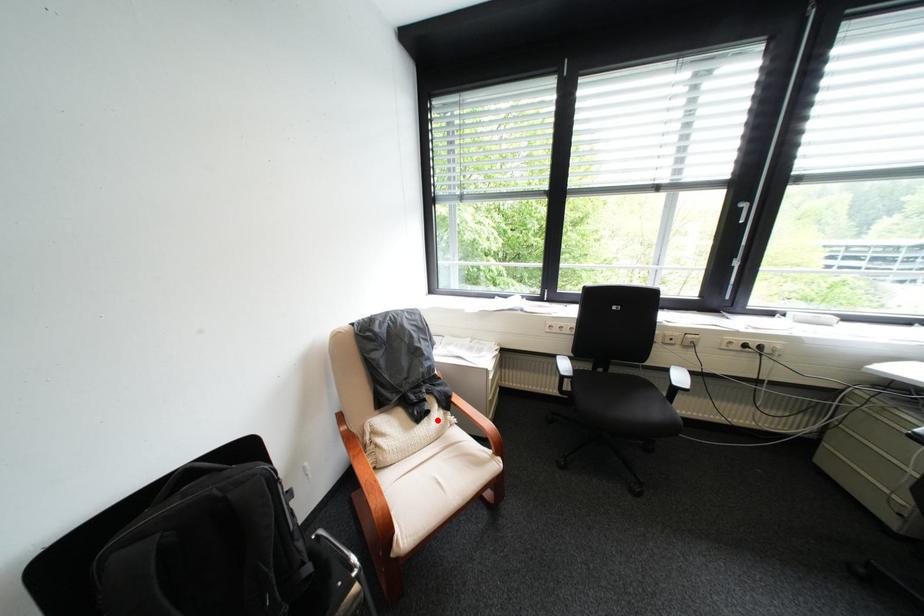
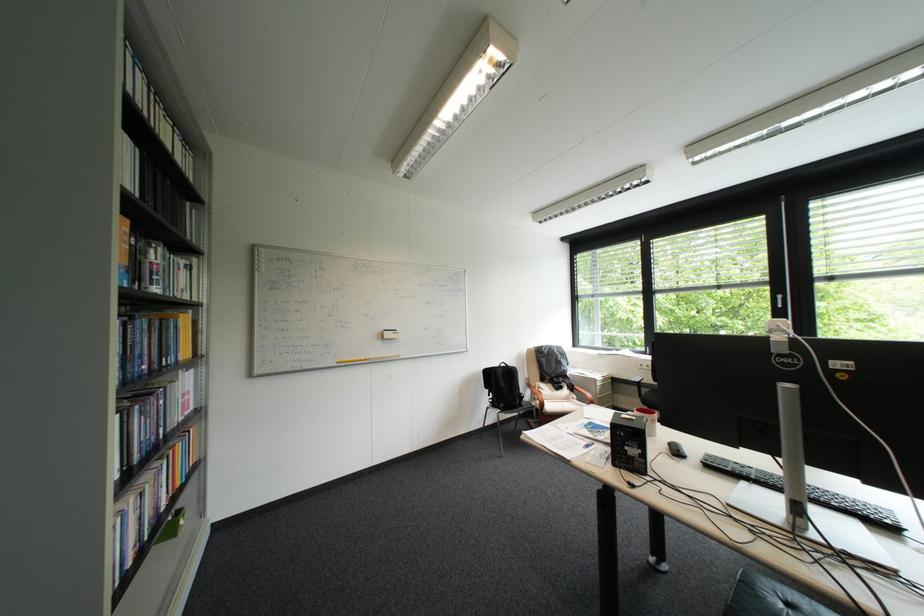
Question: I am providing you with two images of the same scene from different viewpoints. Image1 has a red point marked. In image2, the corresponding 3D location appears at what relative position? Reply with the corresponding letter.

Choices:
 (A) Closer
 (B) Farther

Answer: (B)